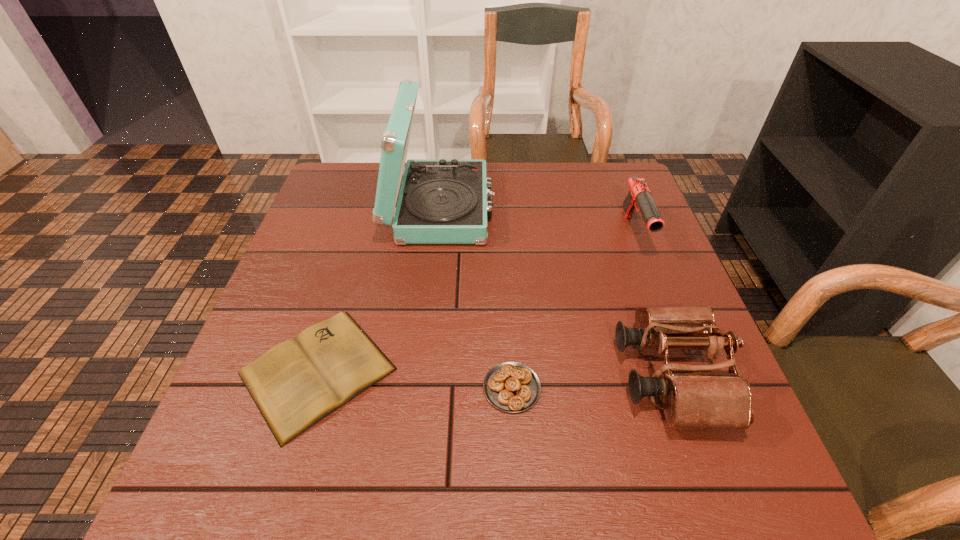
Image resolution: width=960 pixels, height=540 pixels. I want to click on free space located on the right of the second shortest object, so click(713, 388).

Locate an element on the screen. The image size is (960, 540). free space located on the back of the book is located at coordinates (342, 292).

You are a GUI agent. You are given a task and a screenshot of the screen. Output one action in this format:
    pyautogui.click(x=<x>, y=<y>)
    Task: Click on the record player that is at the far edge
    The width and height of the screenshot is (960, 540).
    Given the screenshot: What is the action you would take?
    pyautogui.click(x=442, y=201)

Identify the location of gun located in the far edge section of the desktop. (639, 196).

This screenshot has width=960, height=540. Find the location of `object positioned at the left edge`. object positioned at the left edge is located at coordinates (295, 384).

I want to click on gun at the right edge, so click(639, 196).

You are a GUI agent. You are given a task and a screenshot of the screen. Output one action in this format:
    pyautogui.click(x=<x>, y=<y>)
    Task: Click on the binoculars positioned at the right edge
    This screenshot has height=540, width=960.
    Given the screenshot: What is the action you would take?
    pyautogui.click(x=692, y=395)

You are a GUI agent. You are given a task and a screenshot of the screen. Output one action in this format:
    pyautogui.click(x=<x>, y=<y>)
    Task: Click on the object positioned at the far right corner
    Image resolution: width=960 pixels, height=540 pixels.
    Given the screenshot: What is the action you would take?
    pyautogui.click(x=639, y=196)

You are a GUI agent. You are given a task and a screenshot of the screen. Output one action in this format:
    pyautogui.click(x=<x>, y=<y>)
    Task: Click on the blank space at the far edge of the desktop
    The width and height of the screenshot is (960, 540).
    Given the screenshot: What is the action you would take?
    pyautogui.click(x=516, y=184)

I want to click on vacant space at the near edge of the desktop, so click(572, 471).